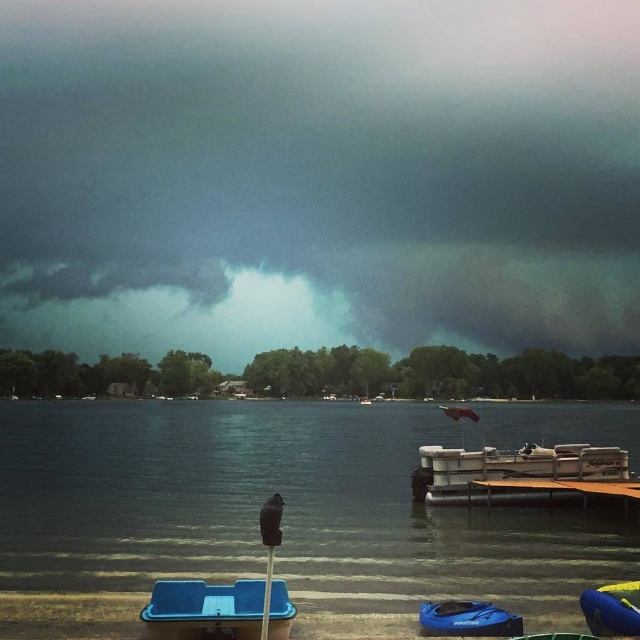
Is blue plastic boat at lower center below yellow-green rubber boat at lower right?

Correct, blue plastic boat at lower center is located below yellow-green rubber boat at lower right.

Which is below, blue plastic boat at lower center or yellow-green rubber boat at lower right?

blue plastic boat at lower center

Measure the distance between point (506, 611) and camera.

Point (506, 611) and camera are 38.34 feet apart from each other.

You are a GUI agent. You are given a task and a screenshot of the screen. Output one action in this format:
    pyautogui.click(x=<x>, y=<y>)
    Task: Click on the blue plastic boat at lower center
    
    Given the screenshot: What is the action you would take?
    (467, 620)

Can you confirm if clear water at lower center is wider than blue plastic boat at lower center?

Indeed, clear water at lower center has a greater width compared to blue plastic boat at lower center.

Does clear water at lower center have a lesser height compared to blue plastic boat at lower center?

No.

Is point (74, 524) closer to viewer compared to point (426, 604)?

That is False.

Locate an element on the screen. clear water at lower center is located at coordinates (262, 500).

The height and width of the screenshot is (640, 640). Find the location of `clear water at lower center`. clear water at lower center is located at coordinates (262, 500).

Is clear water at lower center thinner than blue matte boat at lower center?

No.

Is point (104, 584) positioned in front of point (291, 608)?

That is False.

The image size is (640, 640). Identify the location of clear water at lower center. [x=262, y=500].